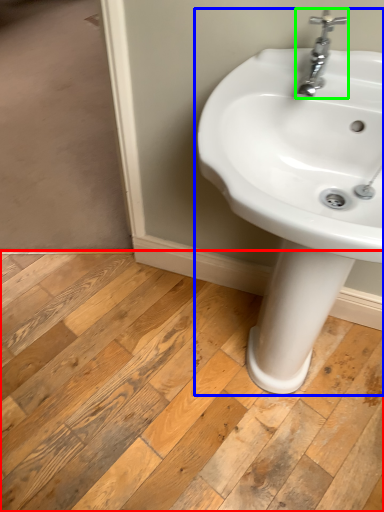
Question: Based on their relative distances, which object is nearer to plank (highlighted by a red box)? Choose from sink (highlighted by a blue box) and tap (highlighted by a green box).

Choices:
 (A) sink
 (B) tap

Answer: (A)